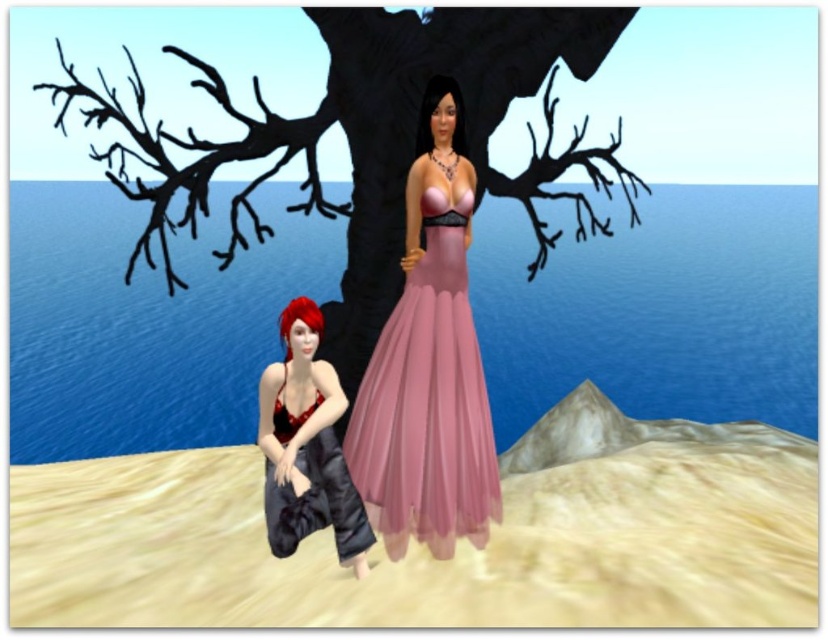
Looking at this image, you are a fashion designer observing two items on a model in the image. The items are the shiny black dress at lower left and the shiny red bikini top at lower left. Which of these two items is larger in size?

The shiny black dress at lower left is bigger than the shiny red bikini top at lower left.

You are a fashion designer observing the digital scene. You need to determine which bikini top is positioned higher in the image. The scene includes a shiny red bikini top at lower left and a pink satin bikini top at center. Which one is higher?

The shiny red bikini top at lower left is taller than the pink satin bikini top at center, so the shiny red bikini top at lower left is positioned higher in the image.

You are standing at the edge of the cliff in the image and want to place a small picnic blanket on the smooth beige sand at lower center. Based on the coordinates provided, where should you position the blanket to ensure it is placed correctly?

You should position the picnic blanket at the coordinates point [425,550] where the smooth beige sand at lower center is located.